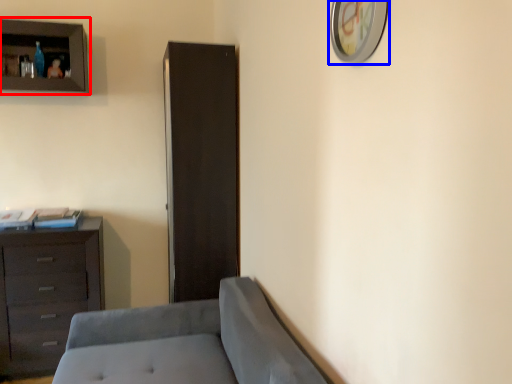
Question: Which object appears closest to the camera in this image, cupboard (highlighted by a red box) or picture frame (highlighted by a blue box)?

Choices:
 (A) cupboard
 (B) picture frame

Answer: (B)